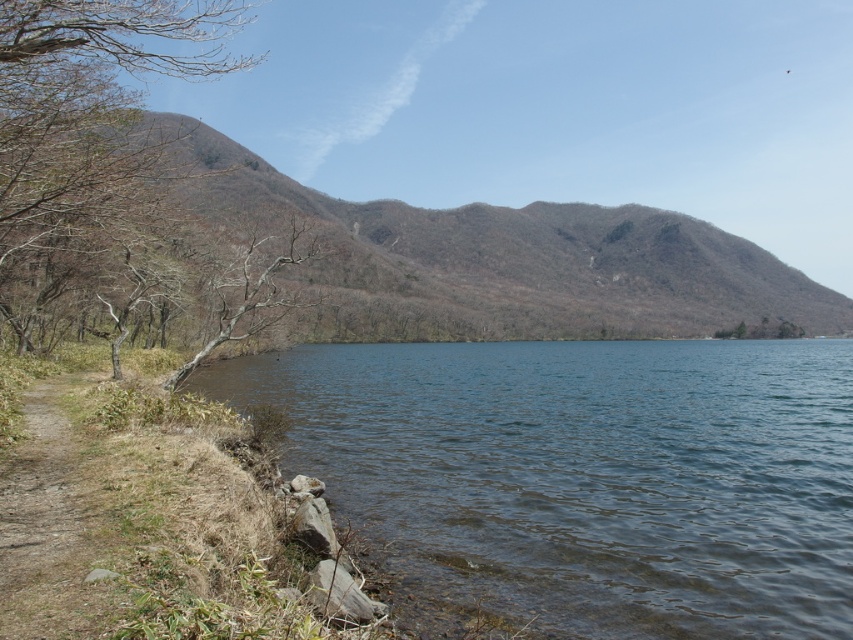
Is clear water at shore left positioned before brown dirt path at lower left?

No, clear water at shore left is behind brown dirt path at lower left.

Which is more to the right, clear water at shore left or brown dirt path at lower left?

clear water at shore left is more to the right.

Measure the distance between clear water at shore left and camera.

clear water at shore left is 11.91 meters away from camera.

This screenshot has height=640, width=853. In order to click on clear water at shore left in this screenshot , I will do `click(587, 474)`.

Find the location of a particular element. The height and width of the screenshot is (640, 853). clear water at shore left is located at coordinates (587, 474).

Is clear water at shore left above brown leafless tree at left?

Incorrect, clear water at shore left is not positioned above brown leafless tree at left.

Which is in front, point (697, 349) or point (28, 220)?

Point (28, 220) is more forward.

In order to click on clear water at shore left in this screenshot , I will do `click(587, 474)`.

What do you see at coordinates (492, 259) in the screenshot?
I see `brown textured mountain at center` at bounding box center [492, 259].

Between brown textured mountain at center and brown leafless tree at left, which one is positioned lower?

brown leafless tree at left

Between point (776, 285) and point (44, 0), which one is positioned behind?

Point (776, 285)

Where is `brown textured mountain at center`? This screenshot has width=853, height=640. brown textured mountain at center is located at coordinates (492, 259).